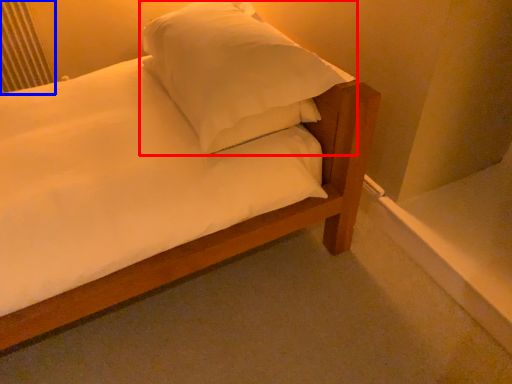
Question: Among these objects, which one is nearest to the camera, pillow (highlighted by a red box) or radiator (highlighted by a blue box)?

Choices:
 (A) pillow
 (B) radiator

Answer: (A)